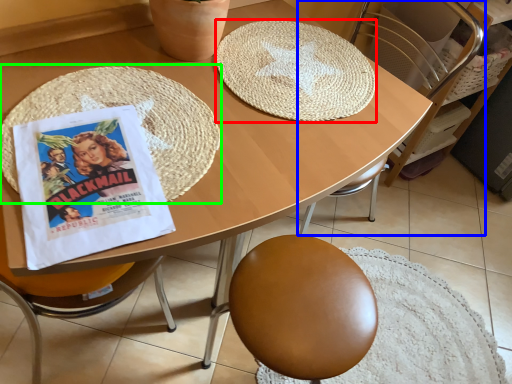
Question: Which object is positioned closest to mat (highlighted by a red box)? Select from chair (highlighted by a blue box) and mat (highlighted by a green box).

Choices:
 (A) chair
 (B) mat

Answer: (B)